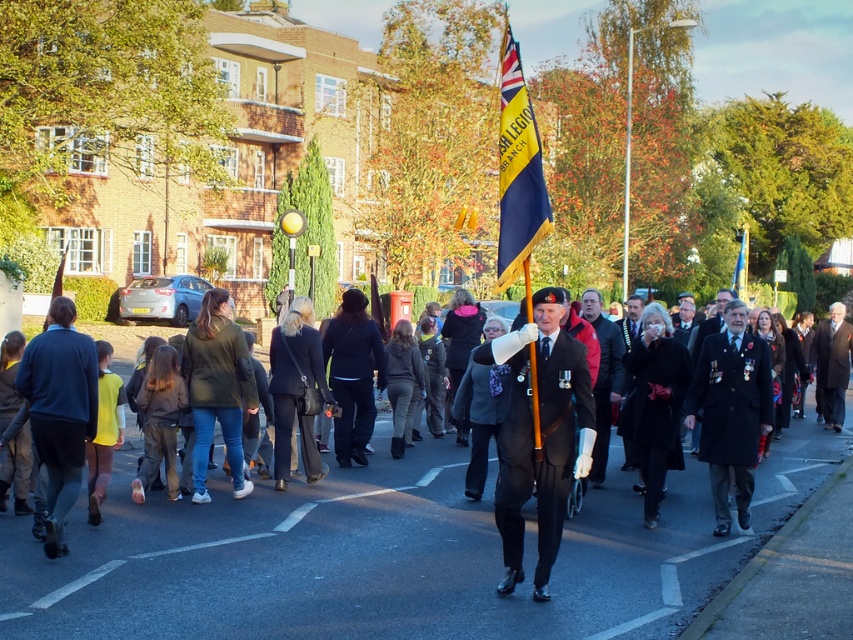
Can you confirm if dark gray wool coat at center is taller than dark brown leather coat at center?

Incorrect, dark gray wool coat at center's height is not larger of dark brown leather coat at center's.

Which is more to the right, dark gray wool coat at center or dark brown leather coat at center?

dark brown leather coat at center is more to the right.

Identify the location of dark gray wool coat at center. The width and height of the screenshot is (853, 640). (602, 380).

The image size is (853, 640). Describe the element at coordinates (61, 410) in the screenshot. I see `dark blue sweater at left` at that location.

Between point (49, 312) and point (740, 284), which one is positioned in front?

Point (49, 312) is more forward.

This screenshot has width=853, height=640. I want to click on dark blue sweater at left, so click(61, 410).

Which of these two, dark blue sweater at left or yellow fabric flag at center, stands shorter?

yellow fabric flag at center

Can you confirm if dark blue sweater at left is thinner than yellow fabric flag at center?

No, dark blue sweater at left is not thinner than yellow fabric flag at center.

Between point (26, 380) and point (531, 148), which one is positioned behind?

Point (26, 380)

Locate an element on the screen. dark blue sweater at left is located at coordinates click(61, 410).